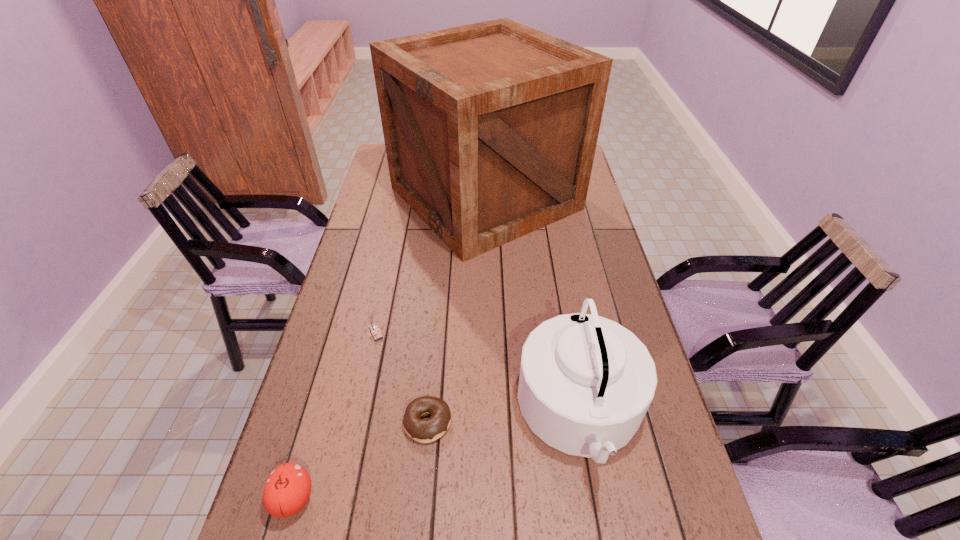
In order to click on the tallest object in this screenshot , I will do 490,129.

This screenshot has height=540, width=960. I want to click on the farthest object, so click(x=490, y=129).

Identify the location of the second tallest object. The image size is (960, 540). (586, 382).

At what (x,y) coordinates should I click in order to perform the action: click on matchbox. Please return your answer as a coordinate pair (x, y). The width and height of the screenshot is (960, 540). Looking at the image, I should click on (372, 325).

Where is `apple`? This screenshot has height=540, width=960. apple is located at coordinates (287, 490).

Where is `the shortest object`? This screenshot has width=960, height=540. the shortest object is located at coordinates (428, 430).

I want to click on vacant space located on the front of the farthest object, so click(x=487, y=332).

The image size is (960, 540). What are the coordinates of `free location located on the spout of the kettle` in the screenshot? It's located at (453, 412).

You are a GUI agent. You are given a task and a screenshot of the screen. Output one action in this format:
    pyautogui.click(x=<x>, y=<y>)
    Task: Click on the vacant space located on the spout of the kettle
    Image resolution: width=960 pixels, height=540 pixels.
    Given the screenshot: What is the action you would take?
    pyautogui.click(x=470, y=412)

This screenshot has width=960, height=540. In order to click on vacant area situated on the spout of the kettle in this screenshot , I will do `click(414, 412)`.